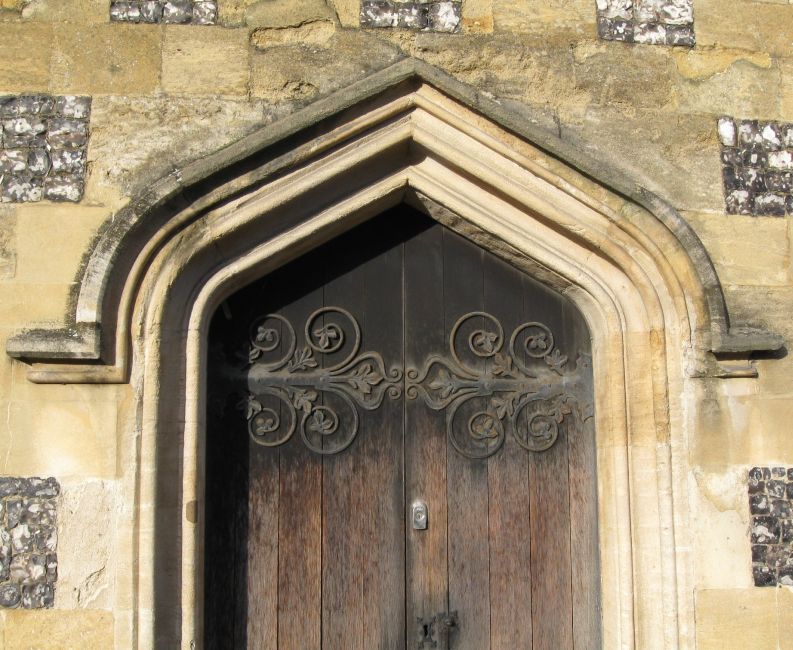
What are the coordinates of `lock` in the screenshot? It's located at (419, 525), (225, 619).